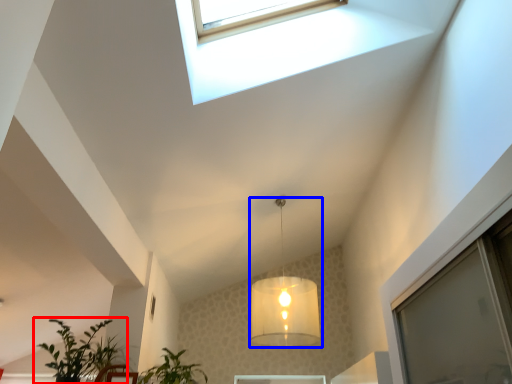
Question: Which of the following is the farthest to the observer, houseplant (highlighted by a red box) or lamp (highlighted by a blue box)?

Choices:
 (A) houseplant
 (B) lamp

Answer: (B)